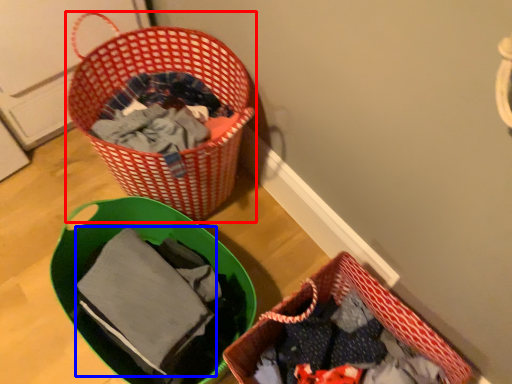
Question: Which of the following is the closest to the observer, picnic basket (highlighted by a red box) or baby clothe (highlighted by a blue box)?

Choices:
 (A) picnic basket
 (B) baby clothe

Answer: (B)